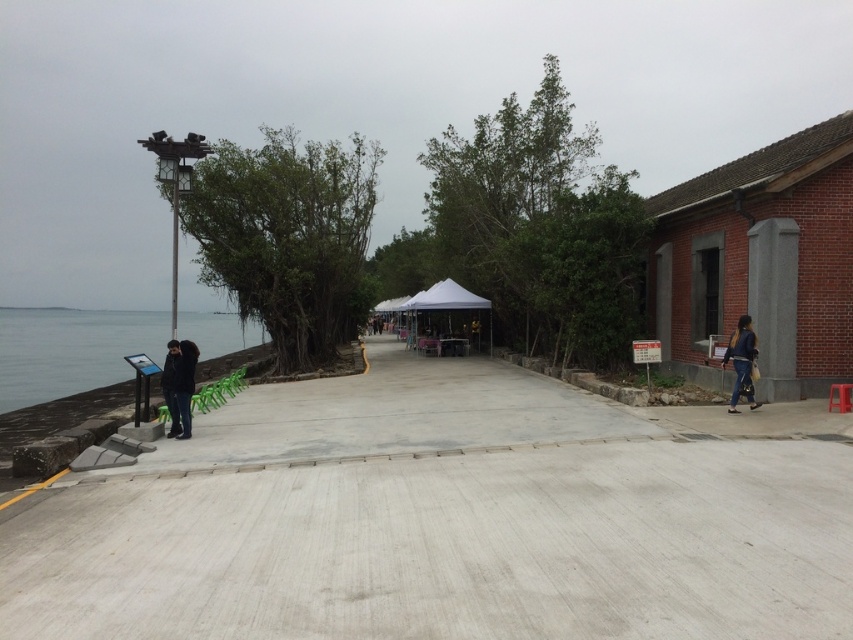
Looking at this image, is gray concrete path at center closer to camera compared to dark blue jeans at right?

Yes, gray concrete path at center is in front of dark blue jeans at right.

From the picture: Measure the distance from gray concrete path at center to dark blue jeans at right.

5.42 meters

Is point (519, 406) less distant than point (735, 352)?

No.

Locate an element on the screen. Image resolution: width=853 pixels, height=640 pixels. gray concrete path at center is located at coordinates (395, 413).

Which is behind, point (53, 554) or point (751, 358)?

Point (751, 358)

Is gray concrete pavement at center smaller than dark blue jeans at right?

No.

Which is behind, point (843, 579) or point (734, 360)?

Positioned behind is point (734, 360).

The width and height of the screenshot is (853, 640). Find the location of `gray concrete pavement at center`. gray concrete pavement at center is located at coordinates (450, 548).

Who is lower down, clear water at lower left or dark blue jacket at left?

dark blue jacket at left is below.

Can you confirm if clear water at lower left is positioned to the left of dark blue jacket at left?

Indeed, clear water at lower left is positioned on the left side of dark blue jacket at left.

Is point (26, 388) closer to camera compared to point (167, 381)?

That is False.

You are a GUI agent. You are given a task and a screenshot of the screen. Output one action in this format:
    pyautogui.click(x=<x>, y=<y>)
    Task: Click on the clear water at lower left
    
    Given the screenshot: What is the action you would take?
    pyautogui.click(x=71, y=349)